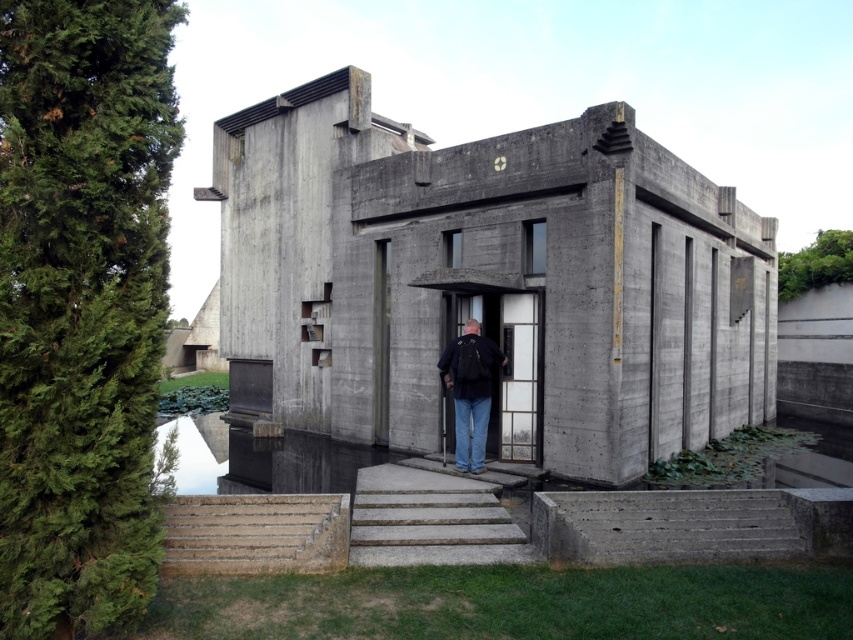
Question: Which point is closer to the camera?

Choices:
 (A) (805, 554)
 (B) (514, 524)
 (C) (207, 525)
 (D) (469, 337)

Answer: (A)

Question: Can you confirm if gray concrete stairs at center is positioned to the left of dark blue jeans at center?

Choices:
 (A) yes
 (B) no

Answer: (A)

Question: Is concrete stairs at lower center to the left of concrete/steps at lower left from the viewer's perspective?

Choices:
 (A) no
 (B) yes

Answer: (A)

Question: Which point is farther to the camera?

Choices:
 (A) concrete/steps at lower left
 (B) concrete stairs at lower center
 (C) gray concrete stairs at center

Answer: (C)

Question: Which object appears closest to the camera in this image?

Choices:
 (A) concrete stairs at lower center
 (B) concrete/steps at lower left
 (C) gray concrete stairs at center
 (D) dark blue jeans at center

Answer: (B)

Question: Can you confirm if concrete stairs at lower center is bigger than concrete/steps at lower left?

Choices:
 (A) no
 (B) yes

Answer: (B)